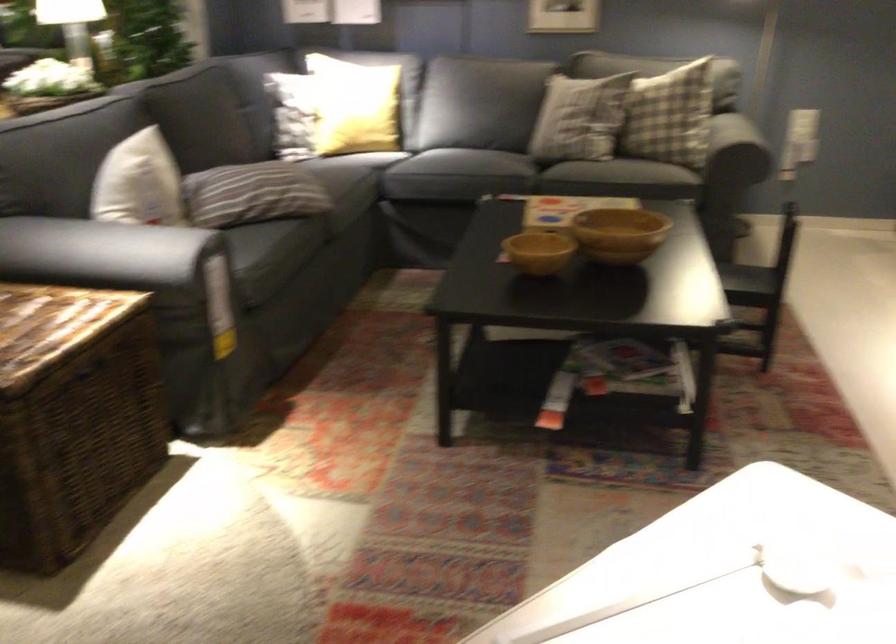
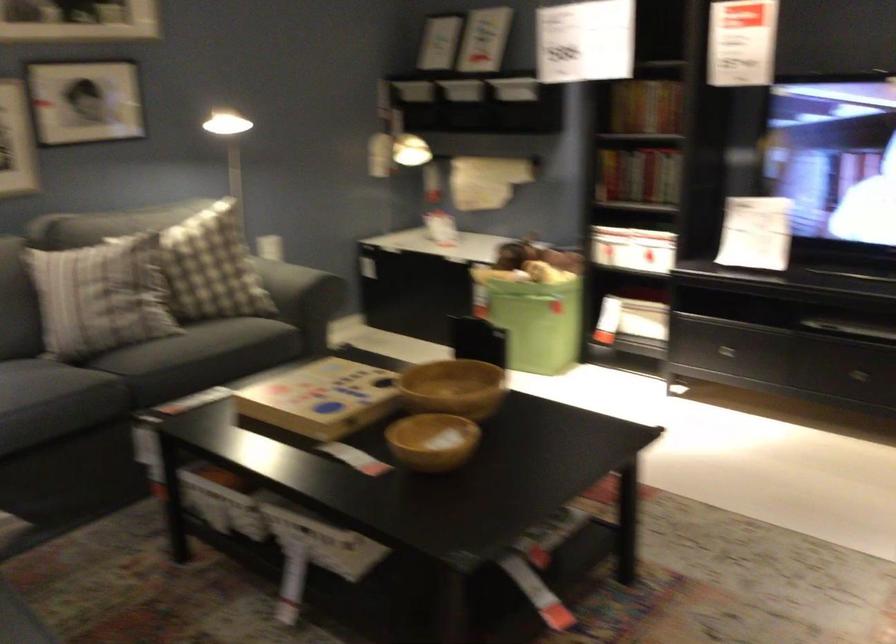
The point at (x=572, y=169) is marked in the first image. Where is the corresponding point in the second image?

(199, 357)